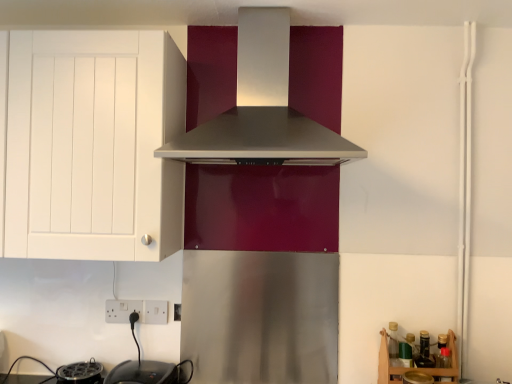
What do you see at coordinates (93, 145) in the screenshot?
I see `white matte cabinet at left` at bounding box center [93, 145].

Find the location of a particular element. black plastic toaster at lower left, positioned as the second appliance in right-to-left order is located at coordinates (80, 373).

What do you see at coordinates (262, 109) in the screenshot? The image size is (512, 384). I see `satin silver range hood at center` at bounding box center [262, 109].

In order to face black glossy electric kettle at lower left, which is counted as the 1th appliance, starting from the right, should I rotate leftwards or rightwards?

Turn left by 15.196 degrees to look at black glossy electric kettle at lower left, which is counted as the 1th appliance, starting from the right.

What is the approximate width of wooden at lower right?

wooden at lower right is 13.14 inches in width.

This screenshot has width=512, height=384. Find the location of `white matte cabinet at left`. white matte cabinet at left is located at coordinates (93, 145).

Is white matte cabinet at left next to satin silver range hood at center and touching it?

There is a gap between white matte cabinet at left and satin silver range hood at center.

Is white matte cabinet at left shorter than satin silver range hood at center?

No, white matte cabinet at left is not shorter than satin silver range hood at center.

From a real-world perspective, is white matte cabinet at left physically located above or below satin silver range hood at center?

white matte cabinet at left is situated lower than satin silver range hood at center in the real world.

How many degrees apart are the facing directions of white matte cabinet at left and satin silver range hood at center?

There is a 1.49-degree angle between the facing directions of white matte cabinet at left and satin silver range hood at center.

From a real-world perspective, is black plastic toaster at lower left, positioned as the second appliance in right-to-left order, physically below white matte cabinet at left?

Indeed, from a real-world perspective, black plastic toaster at lower left, positioned as the second appliance in right-to-left order, is positioned beneath white matte cabinet at left.

Between black plastic toaster at lower left, arranged as the 1th appliance when viewed from the left, and white matte cabinet at left, which one has larger width?

white matte cabinet at left.

Which is less distant, (101,366) or (125,227)?

The point (125,227) is in front.

In the scene shown: Is black plastic toaster at lower left, arranged as the 1th appliance when viewed from the left, further to camera compared to white matte cabinet at left?

Yes, it is.

Which point is more forward, (262, 74) or (385, 376)?

The point (385, 376) is more forward.

Would you say satin silver range hood at center is to the left or to the right of wooden at lower right in the picture?

satin silver range hood at center is positioned on wooden at lower right's left side.

Consider the image. Considering the positions of objects satin silver range hood at center and wooden at lower right in the image provided, who is behind, satin silver range hood at center or wooden at lower right?

wooden at lower right is further from the camera.

Considering the sizes of objects satin silver range hood at center and wooden at lower right in the image provided, who is shorter, satin silver range hood at center or wooden at lower right?

With less height is wooden at lower right.

Based on their sizes in the image, would you say white matte cabinet at left is bigger or smaller than black glossy electric kettle at lower left, placed as the 2th appliance when sorted from left to right?

white matte cabinet at left is bigger than black glossy electric kettle at lower left, placed as the 2th appliance when sorted from left to right.

Which of these two, white matte cabinet at left or black glossy electric kettle at lower left, which is counted as the 1th appliance, starting from the right, is thinner?

black glossy electric kettle at lower left, which is counted as the 1th appliance, starting from the right.

From a real-world perspective, which is physically below, white matte cabinet at left or black glossy electric kettle at lower left, placed as the 2th appliance when sorted from left to right?

In real-world perspective, black glossy electric kettle at lower left, placed as the 2th appliance when sorted from left to right, is lower.

Is white matte cabinet at left at the right side of black glossy electric kettle at lower left, placed as the 2th appliance when sorted from left to right?

In fact, white matte cabinet at left is to the left of black glossy electric kettle at lower left, placed as the 2th appliance when sorted from left to right.

The image size is (512, 384). There is a black plastic toaster at lower left, arranged as the 1th appliance when viewed from the left. In order to click on shelf above it (from a real-world perspective) in this screenshot , I will do `click(388, 364)`.

Is the position of black plastic toaster at lower left, arranged as the 1th appliance when viewed from the left, less distant than that of wooden at lower right?

No, black plastic toaster at lower left, arranged as the 1th appliance when viewed from the left, is further to the viewer.

Is black plastic toaster at lower left, positioned as the second appliance in right-to-left order, looking in the opposite direction of wooden at lower right?

That's not correct — black plastic toaster at lower left, positioned as the second appliance in right-to-left order, is not looking away from wooden at lower right.

Considering the relative positions of white matte cabinet at left and wooden at lower right in the image provided, is white matte cabinet at left to the right of wooden at lower right from the viewer's perspective?

No, white matte cabinet at left is not to the right of wooden at lower right.

Consider the image. From a real-world perspective, is white matte cabinet at left physically located above or below wooden at lower right?

white matte cabinet at left is above wooden at lower right.

Is the depth of white matte cabinet at left greater than that of wooden at lower right?

No, it is in front of wooden at lower right.

Find the location of `cabinetry in front of the wooden at lower right`. cabinetry in front of the wooden at lower right is located at coordinates (93, 145).

Does black plastic toaster at lower left, arranged as the 1th appliance when viewed from the left, turn towards black glossy electric kettle at lower left, which is counted as the 1th appliance, starting from the right?

No, black plastic toaster at lower left, arranged as the 1th appliance when viewed from the left, is not turned towards black glossy electric kettle at lower left, which is counted as the 1th appliance, starting from the right.

Can you confirm if black plastic toaster at lower left, positioned as the second appliance in right-to-left order, is positioned to the left of black glossy electric kettle at lower left, which is counted as the 1th appliance, starting from the right?

Yes, black plastic toaster at lower left, positioned as the second appliance in right-to-left order, is to the left of black glossy electric kettle at lower left, which is counted as the 1th appliance, starting from the right.

Does black plastic toaster at lower left, positioned as the second appliance in right-to-left order, have a smaller size compared to black glossy electric kettle at lower left, placed as the 2th appliance when sorted from left to right?

Correct, black plastic toaster at lower left, positioned as the second appliance in right-to-left order, occupies less space than black glossy electric kettle at lower left, placed as the 2th appliance when sorted from left to right.

How many degrees apart are the facing directions of black plastic toaster at lower left, arranged as the 1th appliance when viewed from the left, and black glossy electric kettle at lower left, placed as the 2th appliance when sorted from left to right?

0.00212 degrees separate the facing orientations of black plastic toaster at lower left, arranged as the 1th appliance when viewed from the left, and black glossy electric kettle at lower left, placed as the 2th appliance when sorted from left to right.

Where is `cabinetry behind the satin silver range hood at center`? Image resolution: width=512 pixels, height=384 pixels. cabinetry behind the satin silver range hood at center is located at coordinates (93, 145).

Find the location of a particular element. This screenshot has width=512, height=384. cabinetry positioned vertically above the black plastic toaster at lower left, arranged as the 1th appliance when viewed from the left (from a real-world perspective) is located at coordinates (93, 145).

Estimate the real-world distances between objects in this image. Which object is further from black plastic toaster at lower left, arranged as the 1th appliance when viewed from the left, black glossy electric kettle at lower left, placed as the 2th appliance when sorted from left to right, or wooden at lower right?

Based on the image, wooden at lower right appears to be further to black plastic toaster at lower left, arranged as the 1th appliance when viewed from the left.

When comparing their distances from wooden at lower right, does black glossy electric kettle at lower left, placed as the 2th appliance when sorted from left to right, or black plastic toaster at lower left, arranged as the 1th appliance when viewed from the left, seem further?

Among the two, black plastic toaster at lower left, arranged as the 1th appliance when viewed from the left, is located further to wooden at lower right.

Estimate the real-world distances between objects in this image. Which object is further from wooden at lower right, black glossy electric kettle at lower left, placed as the 2th appliance when sorted from left to right, or white matte cabinet at left?

white matte cabinet at left is positioned further to the anchor wooden at lower right.

Which object lies further to the anchor point black plastic toaster at lower left, positioned as the second appliance in right-to-left order, satin silver range hood at center or wooden at lower right?

Among the two, wooden at lower right is located further to black plastic toaster at lower left, positioned as the second appliance in right-to-left order.

Based on their spatial positions, is black glossy electric kettle at lower left, placed as the 2th appliance when sorted from left to right, or satin silver range hood at center further from wooden at lower right?

Among the two, satin silver range hood at center is located further to wooden at lower right.

Considering their positions, is black glossy electric kettle at lower left, placed as the 2th appliance when sorted from left to right, positioned closer to satin silver range hood at center than white matte cabinet at left?

The object closer to satin silver range hood at center is white matte cabinet at left.

Estimate the real-world distances between objects in this image. Which object is closer to black glossy electric kettle at lower left, which is counted as the 1th appliance, starting from the right, black plastic toaster at lower left, positioned as the second appliance in right-to-left order, or satin silver range hood at center?

Based on the image, black plastic toaster at lower left, positioned as the second appliance in right-to-left order, appears to be nearer to black glossy electric kettle at lower left, which is counted as the 1th appliance, starting from the right.

When comparing their distances from white matte cabinet at left, does satin silver range hood at center or black plastic toaster at lower left, arranged as the 1th appliance when viewed from the left, seem closer?

Among the two, satin silver range hood at center is located nearer to white matte cabinet at left.

This screenshot has width=512, height=384. Identify the location of cabinetry between satin silver range hood at center and black plastic toaster at lower left, arranged as the 1th appliance when viewed from the left, in the up-down direction. (93, 145).

This screenshot has width=512, height=384. I want to click on home appliance between black plastic toaster at lower left, arranged as the 1th appliance when viewed from the left, and wooden at lower right from left to right, so click(x=262, y=109).

You are a GUI agent. You are given a task and a screenshot of the screen. Output one action in this format:
    pyautogui.click(x=<x>, y=<y>)
    Task: Click on the appliance between satin silver range hood at center and black plastic toaster at lower left, arranged as the 1th appliance when viewed from the left, in the vertical direction
    The image size is (512, 384).
    Given the screenshot: What is the action you would take?
    pyautogui.click(x=143, y=373)

This screenshot has width=512, height=384. What are the coordinates of `cabinetry between satin silver range hood at center and black glossy electric kettle at lower left, which is counted as the 1th appliance, starting from the right, in the up-down direction` in the screenshot? It's located at (93, 145).